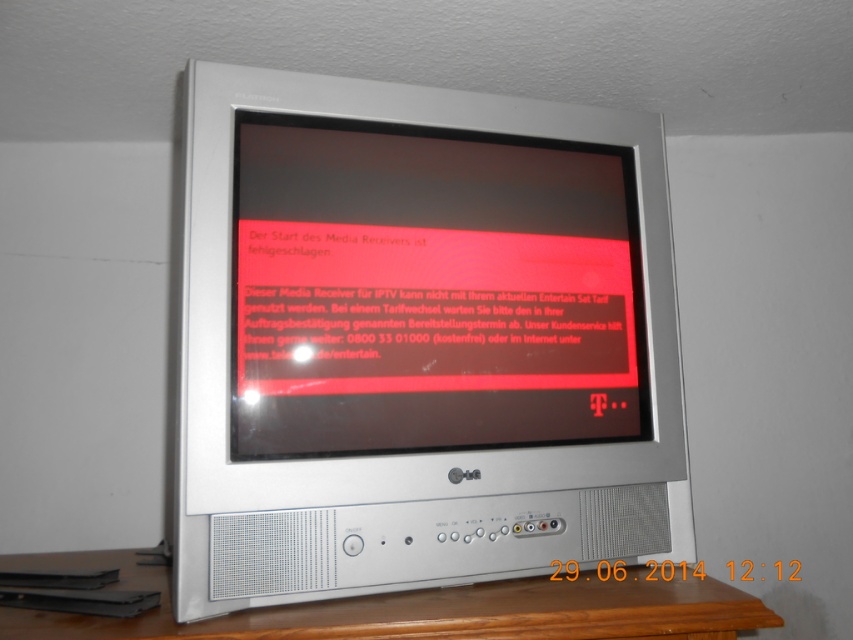
What do you see at coordinates (418, 340) in the screenshot? I see `silver metallic monitor at center` at bounding box center [418, 340].

Which is in front, point (415, 474) or point (599, 360)?

Point (415, 474) is in front.

What do you see at coordinates (418, 340) in the screenshot? The width and height of the screenshot is (853, 640). I see `silver metallic monitor at center` at bounding box center [418, 340].

You are a GUI agent. You are given a task and a screenshot of the screen. Output one action in this format:
    pyautogui.click(x=<x>, y=<y>)
    Task: Click on the silver metallic monitor at center
    This screenshot has height=640, width=853.
    Given the screenshot: What is the action you would take?
    418,340

Is silver metallic monitor at center positioned before wooden table at lower center?

No, it is behind wooden table at lower center.

Is silver metallic monitor at center further to the viewer compared to wooden table at lower center?

That is True.

The width and height of the screenshot is (853, 640). Describe the element at coordinates (418, 340) in the screenshot. I see `silver metallic monitor at center` at that location.

Locate an element on the screen. This screenshot has height=640, width=853. silver metallic monitor at center is located at coordinates (418, 340).

Does point (355, 211) come closer to viewer compared to point (604, 588)?

That is True.

Who is positioned more to the right, matte black screen at center or wooden table at lower center?

matte black screen at center is more to the right.

I want to click on matte black screen at center, so point(430,291).

Image resolution: width=853 pixels, height=640 pixels. Find the location of `matte black screen at center`. matte black screen at center is located at coordinates (430, 291).